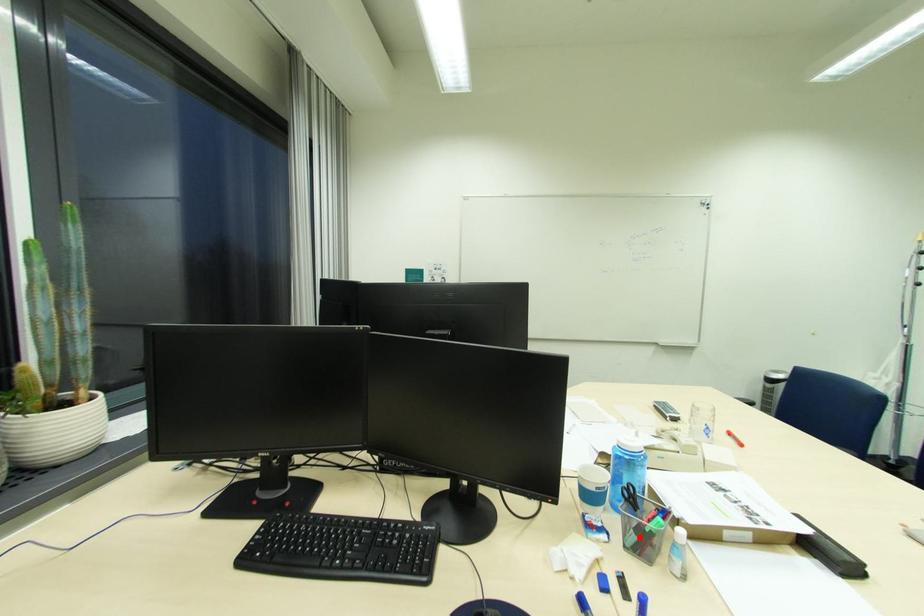
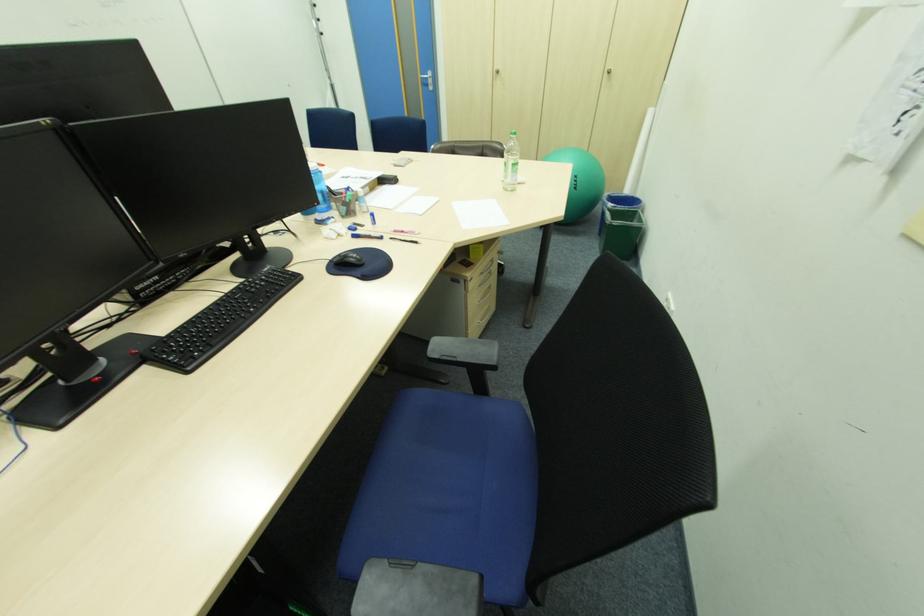
Find the pixel in the second image that matches the highlighted location in the first image.

(349, 209)